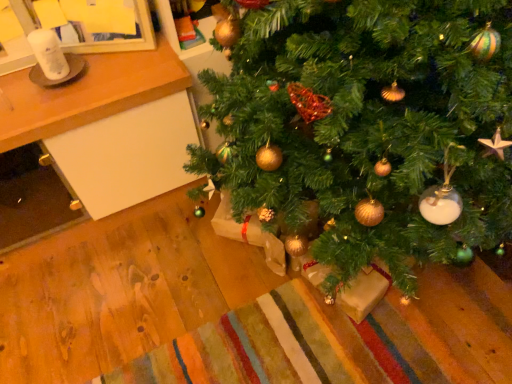
Identify the location of empty space that is ontop of wooden table at lower left (from a real-world perspective). (72, 72).